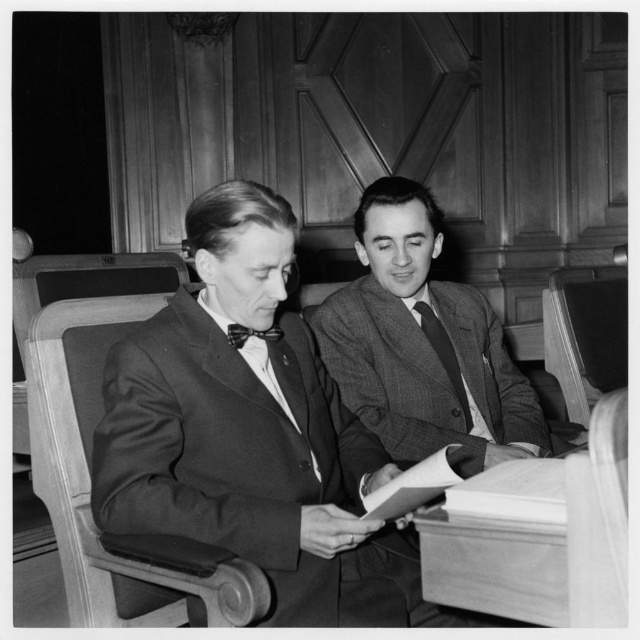
Which is more to the left, smooth black suit at left or textured gray suit at center?

Positioned to the left is smooth black suit at left.

Is point (161, 349) positioned before point (472, 333)?

Yes.

Find the location of a particular element. This screenshot has width=640, height=640. smooth black suit at left is located at coordinates (250, 432).

Can you confirm if wooden chair at right is positioned below black textured tie at center?

Incorrect, wooden chair at right is not positioned below black textured tie at center.

Between wooden chair at right and black textured tie at center, which one is positioned higher?

wooden chair at right is higher up.

Locate an element on the screen. wooden chair at right is located at coordinates (586, 333).

Measure the distance between smooth black suit at left and camera.

A distance of 3.89 feet exists between smooth black suit at left and camera.

Is smooth black suit at left closer to the viewer compared to plaid fabric bow tie at center?

Yes, it is.

Does point (374, 588) come in front of point (253, 330)?

Yes, point (374, 588) is closer to viewer.

Identify the location of smooth black suit at left. (250, 432).